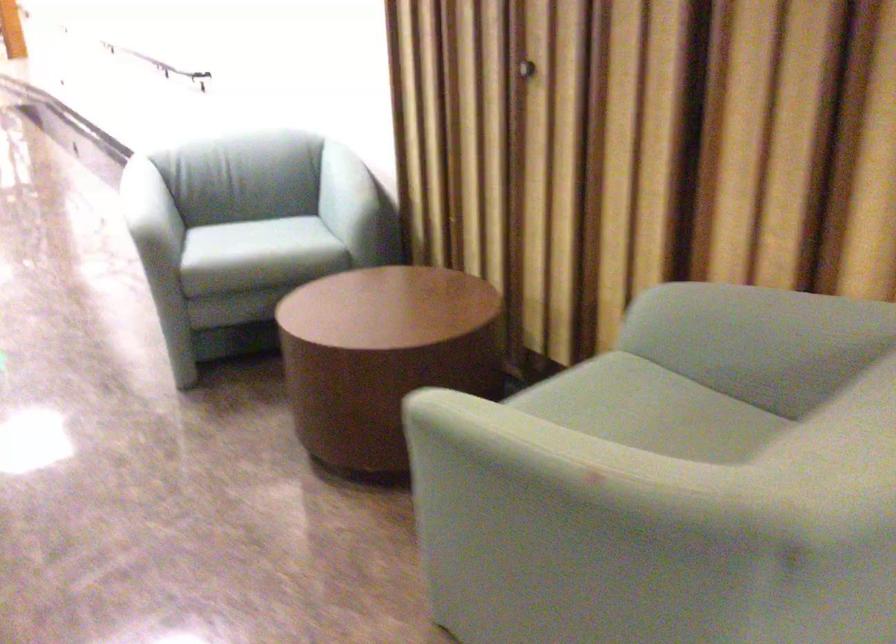
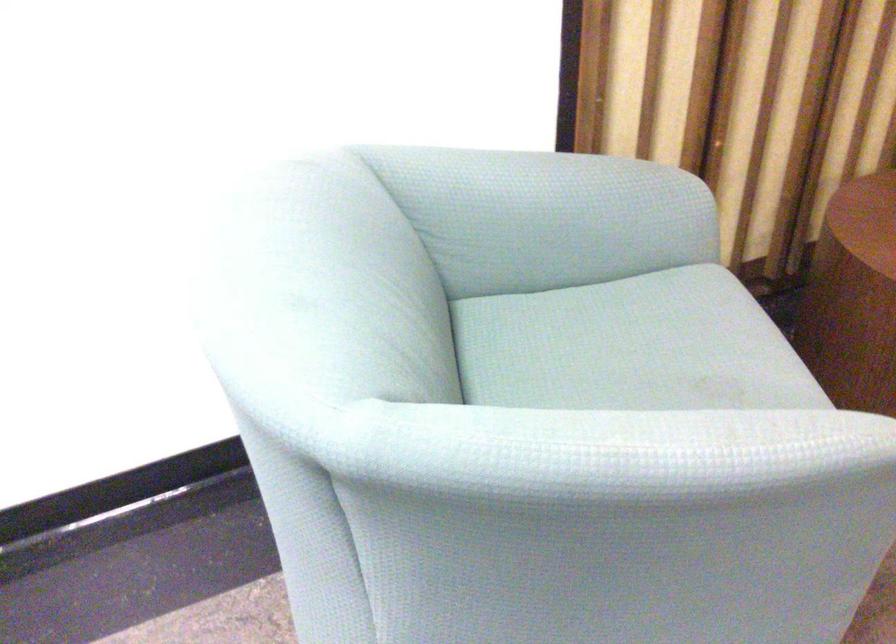
Locate, in the second image, the point that corresponds to point (268, 232) in the first image.

(631, 346)